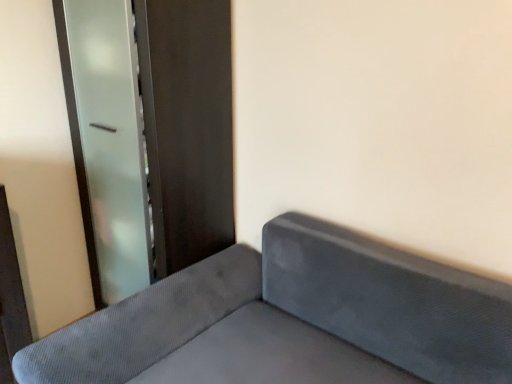
Locate an element on the screen. velvet gray couch at lower right is located at coordinates (292, 320).

The width and height of the screenshot is (512, 384). What do you see at coordinates (292, 320) in the screenshot?
I see `velvet gray couch at lower right` at bounding box center [292, 320].

Where is `velvet gray couch at lower right`? The height and width of the screenshot is (384, 512). velvet gray couch at lower right is located at coordinates (292, 320).